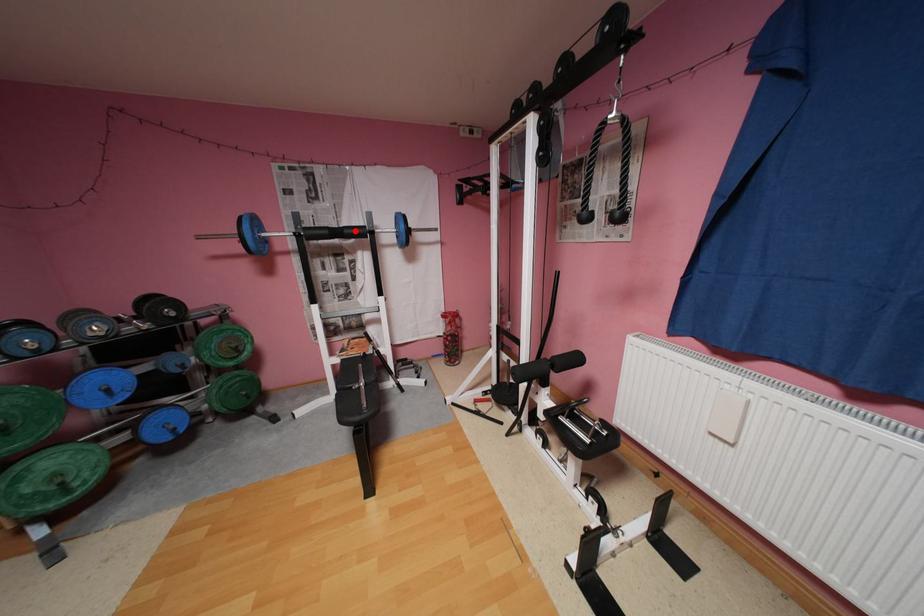
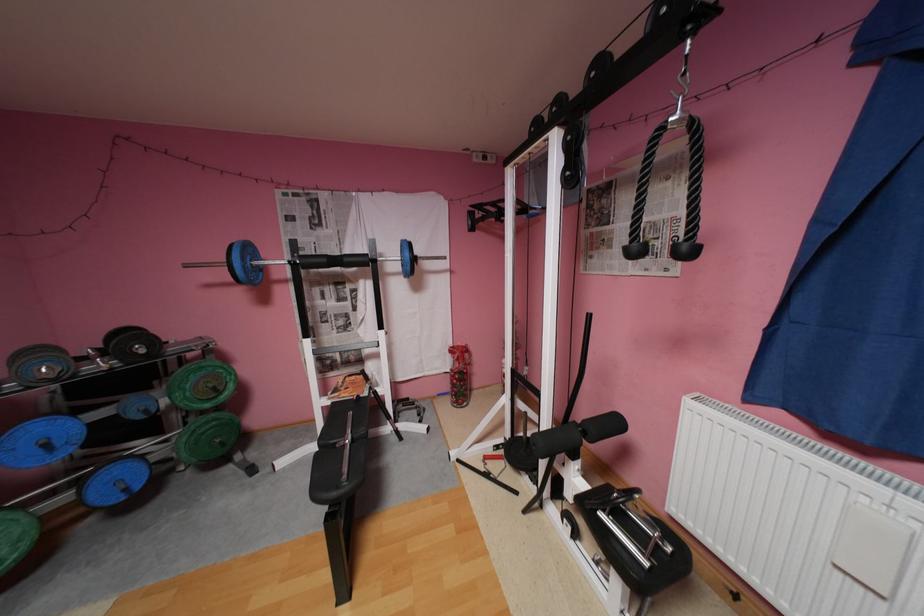
Locate, in the second image, the point that corresponds to the highlighted location in the first image.

(355, 259)